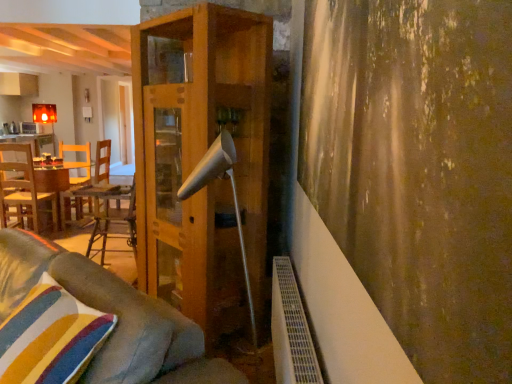
Question: Can you confirm if velvet gray couch at lower left is positioned to the left of matte white cabinet at upper left?

Choices:
 (A) no
 (B) yes

Answer: (A)

Question: From a real-world perspective, is velvet gray couch at lower left on top of matte white cabinet at upper left?

Choices:
 (A) no
 (B) yes

Answer: (A)

Question: Is velvet gray couch at lower left thinner than matte white cabinet at upper left?

Choices:
 (A) no
 (B) yes

Answer: (A)

Question: Could you tell me if velvet gray couch at lower left is facing matte white cabinet at upper left?

Choices:
 (A) no
 (B) yes

Answer: (A)

Question: Is there a large distance between velvet gray couch at lower left and matte white cabinet at upper left?

Choices:
 (A) yes
 (B) no

Answer: (A)

Question: Is velvet gray couch at lower left shorter than matte white cabinet at upper left?

Choices:
 (A) yes
 (B) no

Answer: (B)

Question: Is textured brown curtain at right to the left of striped fabric pillow at lower left from the viewer's perspective?

Choices:
 (A) no
 (B) yes

Answer: (A)

Question: Can we say textured brown curtain at right lies outside striped fabric pillow at lower left?

Choices:
 (A) no
 (B) yes

Answer: (B)

Question: Is textured brown curtain at right facing away from striped fabric pillow at lower left?

Choices:
 (A) yes
 (B) no

Answer: (B)

Question: Is textured brown curtain at right further to the viewer compared to striped fabric pillow at lower left?

Choices:
 (A) no
 (B) yes

Answer: (A)

Question: From a real-world perspective, is textured brown curtain at right below striped fabric pillow at lower left?

Choices:
 (A) no
 (B) yes

Answer: (A)

Question: Could striped fabric pillow at lower left be considered to be inside textured brown curtain at right?

Choices:
 (A) yes
 (B) no

Answer: (B)

Question: Considering the relative sizes of white matte lamp at center and wooden table at left, acting as the 1th table starting from the top, in the image provided, is white matte lamp at center shorter than wooden table at left, acting as the 1th table starting from the top,?

Choices:
 (A) yes
 (B) no

Answer: (B)